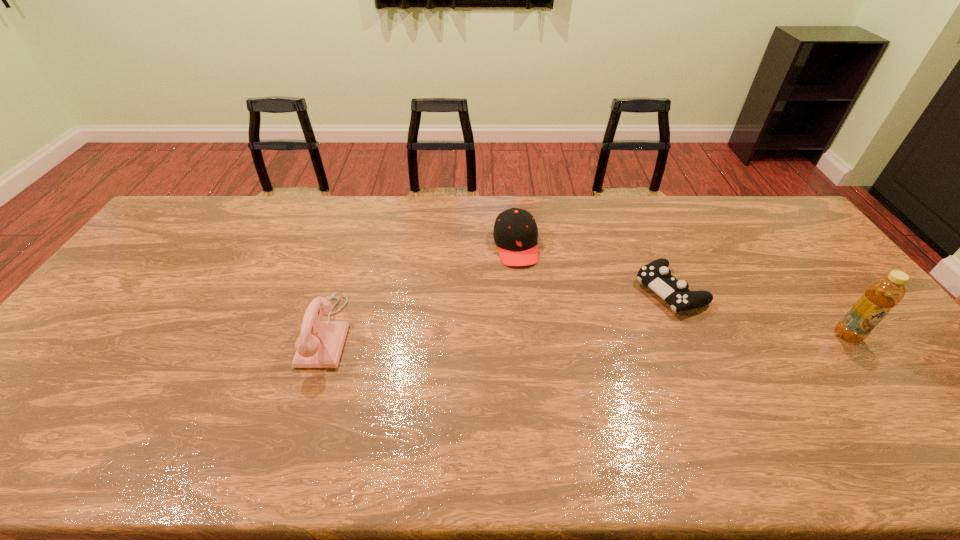
Locate an element on the screen. The image size is (960, 540). vacant space located 0.180m on the dial of the telephone is located at coordinates (238, 332).

Identify the location of free region located on the back of the tallest object. The width and height of the screenshot is (960, 540). (791, 260).

Where is `free point located on the front-facing side of the cap`? This screenshot has width=960, height=540. free point located on the front-facing side of the cap is located at coordinates (541, 367).

You are a GUI agent. You are given a task and a screenshot of the screen. Output one action in this format:
    pyautogui.click(x=<x>, y=<y>)
    Task: Click on the blank space located 0.100m on the front-facing side of the cap
    This screenshot has width=960, height=540.
    Given the screenshot: What is the action you would take?
    pyautogui.click(x=525, y=291)

Where is `free location located 0.190m on the front-facing side of the cap`? free location located 0.190m on the front-facing side of the cap is located at coordinates (530, 314).

Find the location of a particular element. vacant space situated 0.150m on the surface of the control is located at coordinates (606, 323).

You are a GUI agent. You are given a task and a screenshot of the screen. Output one action in this format:
    pyautogui.click(x=<x>, y=<y>)
    Task: Click on the vacant region located 0.310m on the surface of the control
    The height and width of the screenshot is (540, 960).
    Given the screenshot: What is the action you would take?
    pyautogui.click(x=560, y=346)

The image size is (960, 540). I want to click on vacant space located on the surface of the control, so click(x=587, y=333).

The image size is (960, 540). What are the coordinates of `object present at the far edge` in the screenshot? It's located at (515, 233).

The height and width of the screenshot is (540, 960). I want to click on object positioned at the right edge, so click(x=884, y=293).